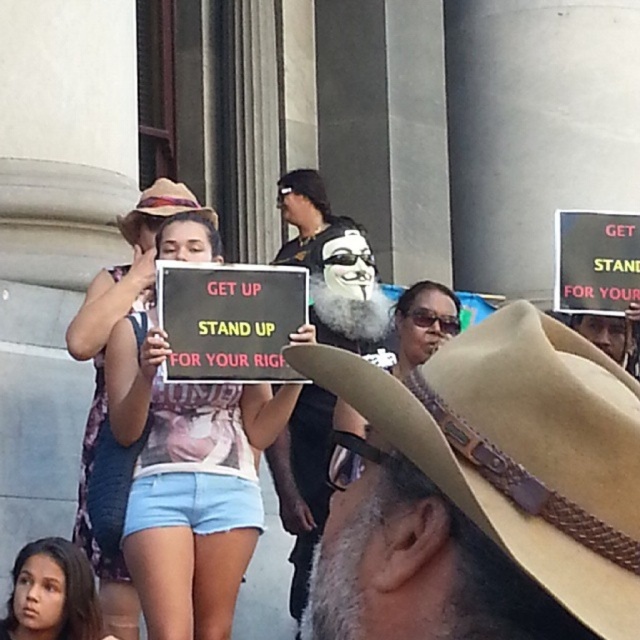
You are a photographer trying to capture the central protester holding the sign. To frame the shot, you need to ensure the brown leather cowboy hat at lower right does not block the sign. Based on its position, can you determine if the hat is positioned to the left or right of the central protester?

The brown leather cowboy hat at lower right is located at point 0.769 on the horizontal axis. Since the central protester is in the middle of the image, the hat is positioned to the right of the central protester, so it may block the view if not adjusted.

You are a photographer trying to capture the central figure in the protest scene. You notice the matte white tank top at center and the light blue denim shorts at lower left. Which clothing item is positioned to the right of the other?

The matte white tank top at center is positioned on the right side of light blue denim shorts at lower left.